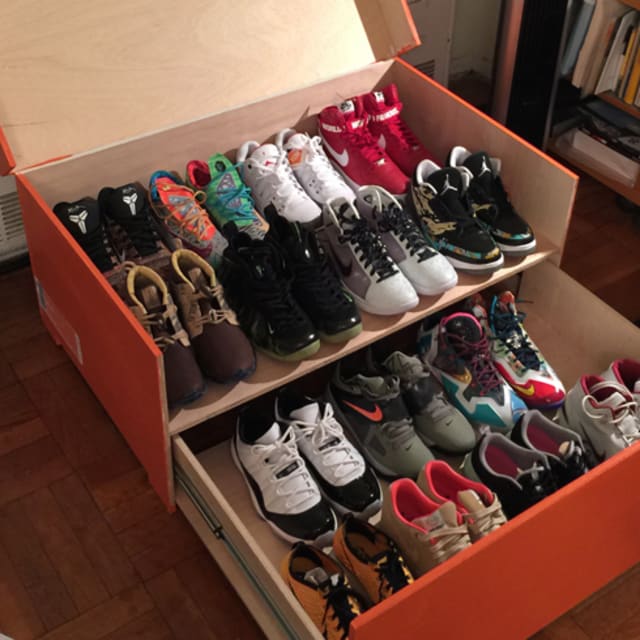
Where is `parquet floor`? This screenshot has height=640, width=640. parquet floor is located at coordinates (127, 559).